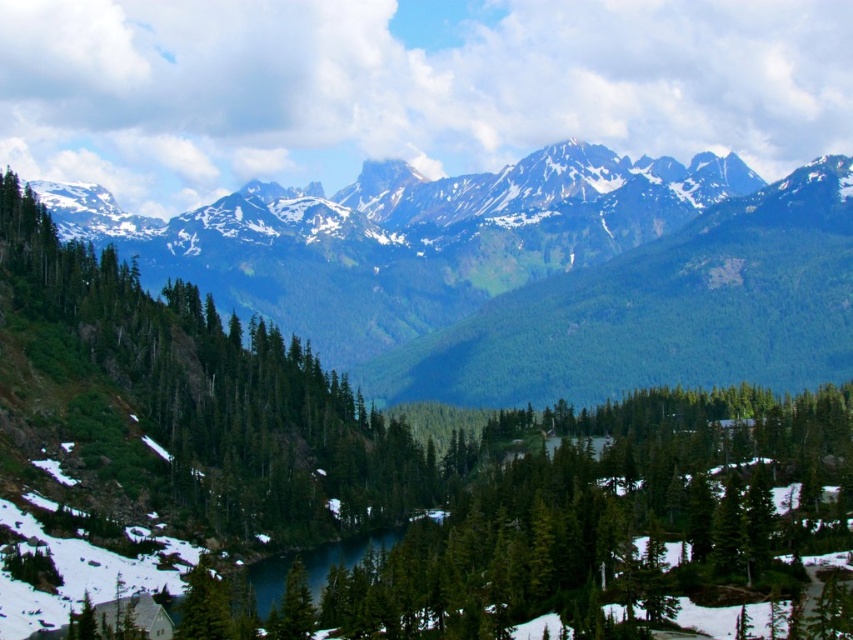
From the picture: Can you confirm if green textured mountains at center is bigger than green matte tree at center?

Yes.

Measure the distance between point (x=445, y=225) and camera.

A distance of 1874.42 feet exists between point (x=445, y=225) and camera.

Where is `green textured mountains at center`? This screenshot has width=853, height=640. green textured mountains at center is located at coordinates click(529, 275).